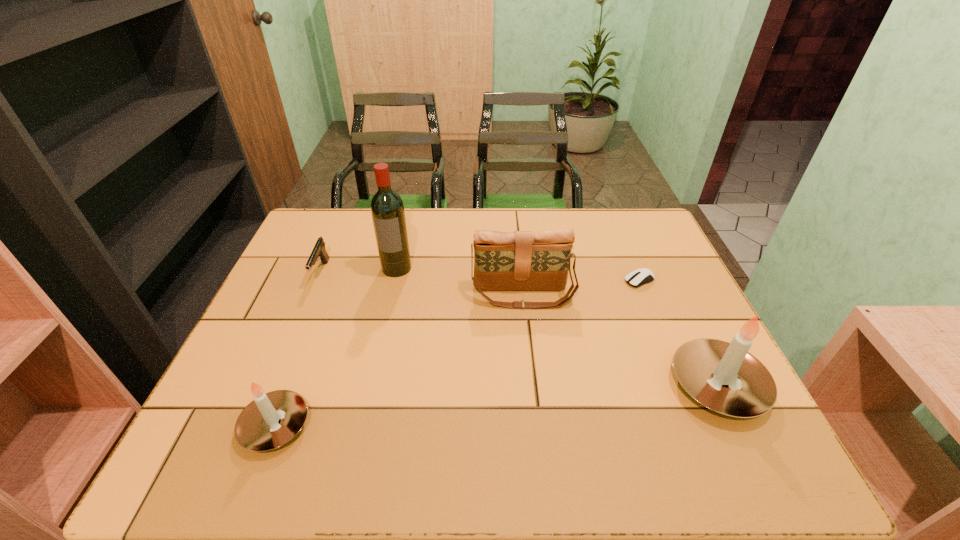
At what (x,y) coordinates should I click in order to perform the action: click on object that is at the near right corner. Please return your answer as a coordinate pair (x, y). The image size is (960, 540). Looking at the image, I should click on (702, 366).

Locate an element on the screen. The height and width of the screenshot is (540, 960). free region at the far edge of the desktop is located at coordinates (586, 226).

Locate an element on the screen. The image size is (960, 540). vacant region at the near edge of the desktop is located at coordinates (553, 419).

Locate an element on the screen. The width and height of the screenshot is (960, 540). free region at the left edge of the desktop is located at coordinates (313, 282).

Identify the location of vacant area at the far right corner. (634, 219).

Locate an element on the screen. Image resolution: width=960 pixels, height=540 pixels. unoccupied position between the pistol and the tallest object is located at coordinates (359, 271).

At what (x,y) coordinates should I click in order to perform the action: click on free space that is in between the wine bottle and the pistol. Please return your answer as a coordinate pair (x, y). Image resolution: width=960 pixels, height=540 pixels. Looking at the image, I should click on (359, 271).

At what (x,y) coordinates should I click in order to perform the action: click on free space between the third shortest object and the mouse. Please return your answer as a coordinate pair (x, y). Looking at the image, I should click on [458, 353].

Image resolution: width=960 pixels, height=540 pixels. I want to click on blank region between the left candle and the fourth object from left to right, so click(399, 360).

Where is `free space between the fourth object from right to left and the second shortest object`? The image size is (960, 540). free space between the fourth object from right to left and the second shortest object is located at coordinates (359, 271).